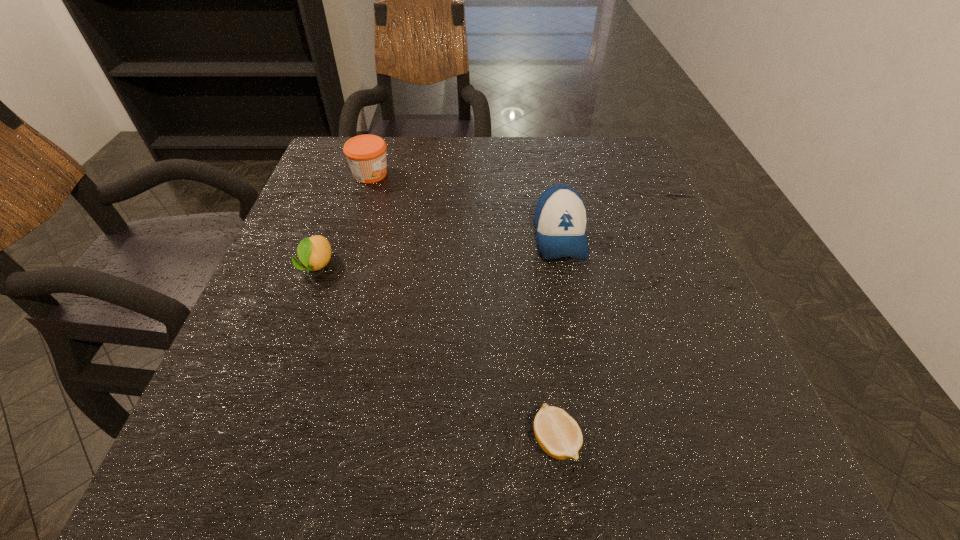
What are the coordinates of `baseball cap` in the screenshot? It's located at (560, 218).

Where is `the farthest object`? the farthest object is located at coordinates (366, 154).

Where is `jam`? This screenshot has height=540, width=960. jam is located at coordinates (366, 154).

At what (x,y) coordinates should I click in order to perform the action: click on the second shortest object. Please return your answer as a coordinate pair (x, y). The image size is (960, 540). Looking at the image, I should click on (314, 253).

Locate an element on the screen. Image resolution: width=960 pixels, height=540 pixels. the taller lemon is located at coordinates (314, 253).

This screenshot has height=540, width=960. What are the coordinates of `the shorter lemon` in the screenshot? It's located at (558, 434).

This screenshot has height=540, width=960. In order to click on the right lemon in this screenshot , I will do `click(558, 434)`.

The image size is (960, 540). I want to click on vacant space located 0.280m on the front-facing side of the baseball cap, so [x=591, y=398].

You are a GUI agent. You are given a task and a screenshot of the screen. Output one action in this format:
    pyautogui.click(x=<x>, y=<y>)
    Task: Click on the blank area located on the front label of the third shortest object
    Image resolution: width=960 pixels, height=540 pixels.
    Given the screenshot: What is the action you would take?
    pyautogui.click(x=451, y=174)

Where is `vacant space situated with leaves positioned above the left lemon`? vacant space situated with leaves positioned above the left lemon is located at coordinates (298, 317).